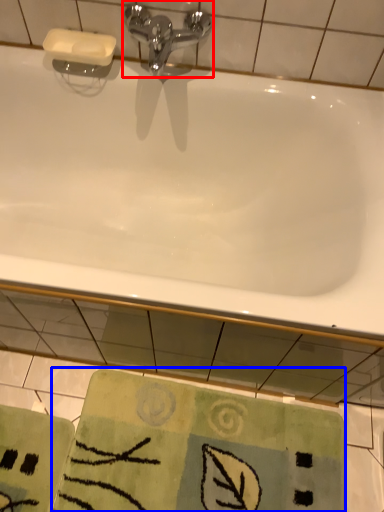
Question: Which point is further to the camera, tap (highlighted by a red box) or beach towel (highlighted by a blue box)?

Choices:
 (A) tap
 (B) beach towel

Answer: (B)